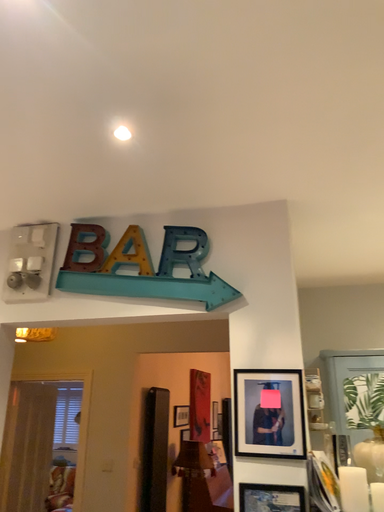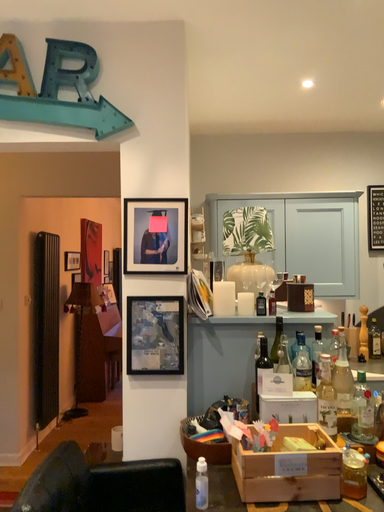
Question: How did the camera likely rotate when shooting the video?

Choices:
 (A) rotated right
 (B) rotated left

Answer: (A)